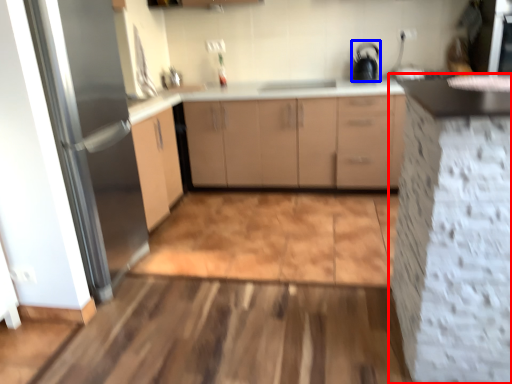
Question: Which of the following is the farthest to the observer, cabinetry (highlighted by a red box) or appliance (highlighted by a blue box)?

Choices:
 (A) cabinetry
 (B) appliance

Answer: (B)